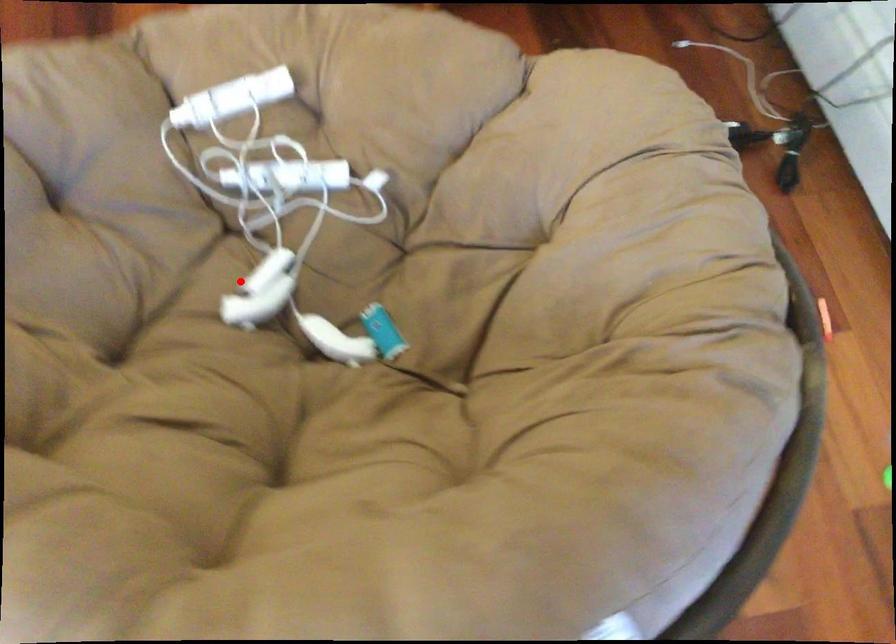
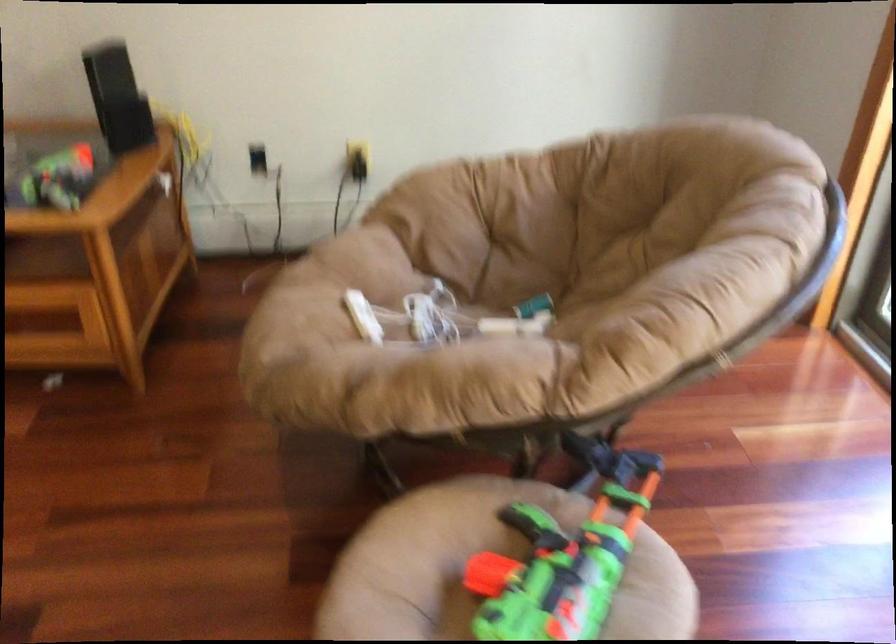
In the second image, find the point that corresponds to the highlighted location in the first image.

(512, 326)